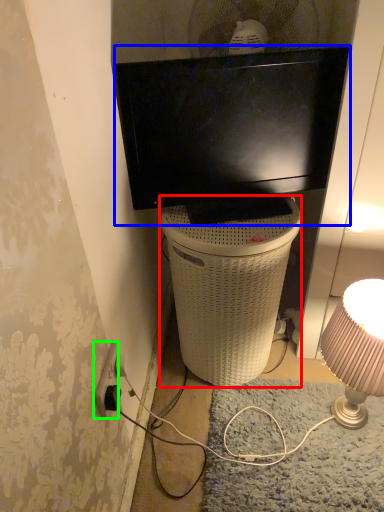
Question: Estimate the real-world distances between objects in this image. Which object is closer to trash bin/can (highlighted by a red box), television (highlighted by a blue box) or power outlet (highlighted by a green box)?

Choices:
 (A) television
 (B) power outlet

Answer: (A)